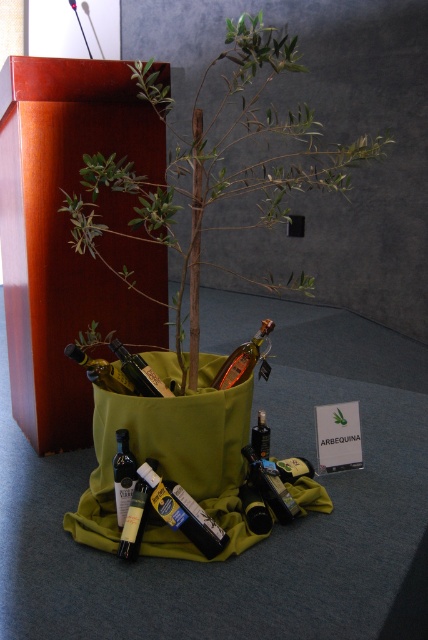
You are standing in the presentation space and want to place a 4 feet long banner between yourself and the green fabric bag at center. Is there enough space to do so without moving any other objects?

The distance between you and the green fabric bag at center is 3.81 feet, which is less than the 4 feet required for the banner. Therefore, there is not enough space to place the banner without moving other objects.

What object is located at the coordinates point [184,513]?

The dark green glass bottle at lower center is located at point [184,513].

You are organizing a display and need to place a decorative item between the dark green glass bottle at lower center and the matte glass bottle at lower left. Which bottle should the item be placed closer to if you want it to appear larger in the final photo?

The dark green glass bottle at lower center is closer to the viewer than the matte glass bottle at lower left. To make the decorative item appear larger in the photo, place it closer to the dark green glass bottle at lower center since objects closer to the camera appear larger.